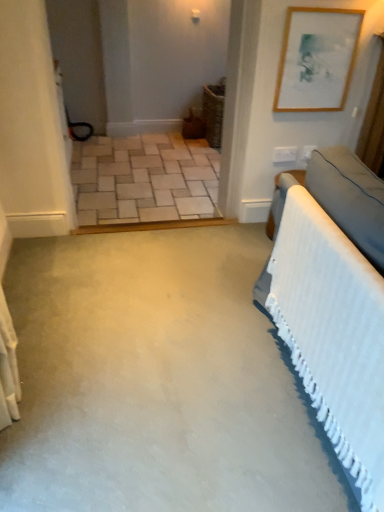
Question: Is beige brick floor at center spatially inside velvet grey bed at right, or outside of it?

Choices:
 (A) inside
 (B) outside

Answer: (B)

Question: From the image's perspective, relative to velvet grey bed at right, is beige brick floor at center above or below?

Choices:
 (A) below
 (B) above

Answer: (B)

Question: Which is farther from the velvet grey bed at right?

Choices:
 (A) wooden picture frame at upper right
 (B) beige brick floor at center

Answer: (B)

Question: Which object is the closest to the wooden picture frame at upper right?

Choices:
 (A) velvet grey bed at right
 (B) beige brick floor at center

Answer: (A)